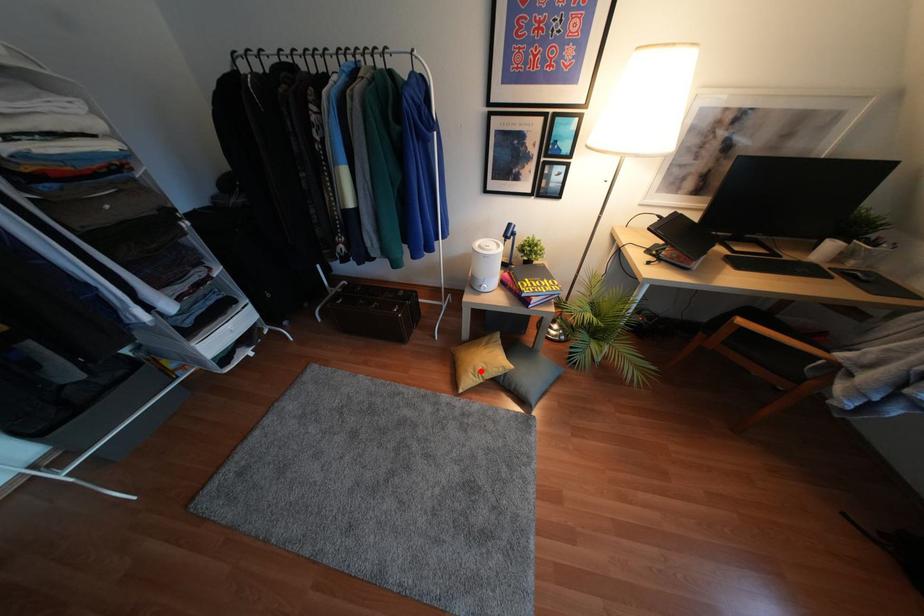
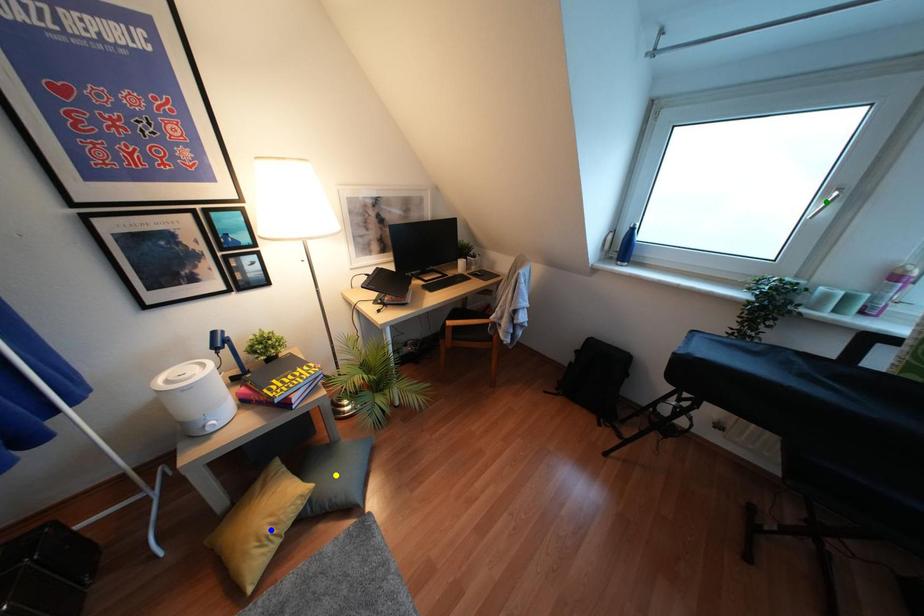
Question: I am providing you with two images of the same scene from different viewpoints. A red point is marked on the first image. You are given multiple points on the second image. Can you choose the point in image 2 that corresponds to the point in image 1?

Choices:
 (A) green point
 (B) yellow point
 (C) blue point

Answer: (C)